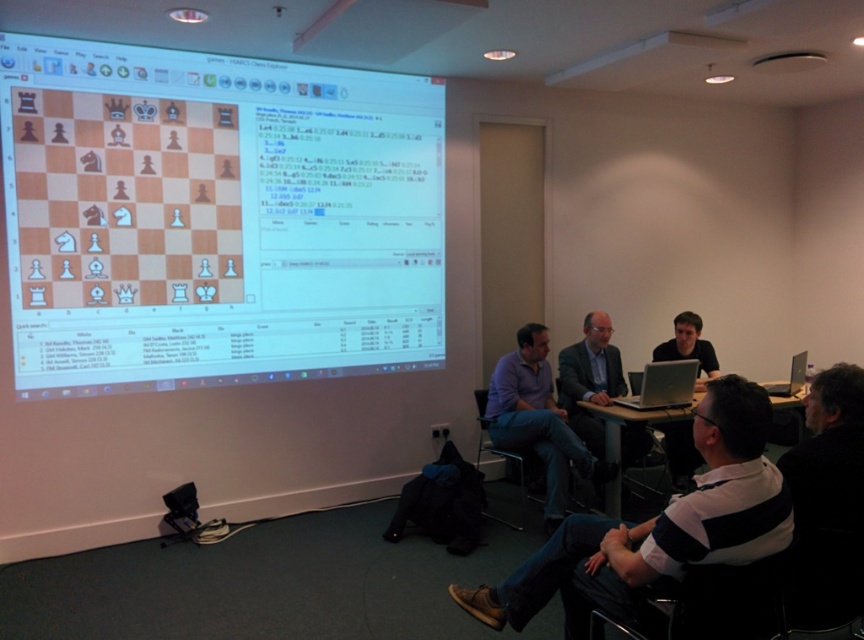
You are standing in the room described. The point with coordinates (658, 529) is marked on the floor. Can you tell me what object or person is located at that point?

The point at coordinates (658, 529) marks the location of the white striped shirt at lower right.

You are a student sitting at the center of the classroom. You need to locate the point with coordinates (x=664, y=385) on the silver metallic laptop at center. Where would you find this point on the laptop?

The point with coordinates (x=664, y=385) is located on the silver metallic laptop at center.

You are a photographer standing in the classroom. You want to take a photo of the purple cotton shirt at center without the white glossy chessboard at upper left blocking it. Is this possible based on their positions?

The white glossy chessboard at upper left is positioned over the purple cotton shirt at center, so it is blocking the view. Therefore, you cannot take a photo of the purple cotton shirt at center without the chessboard blocking it.